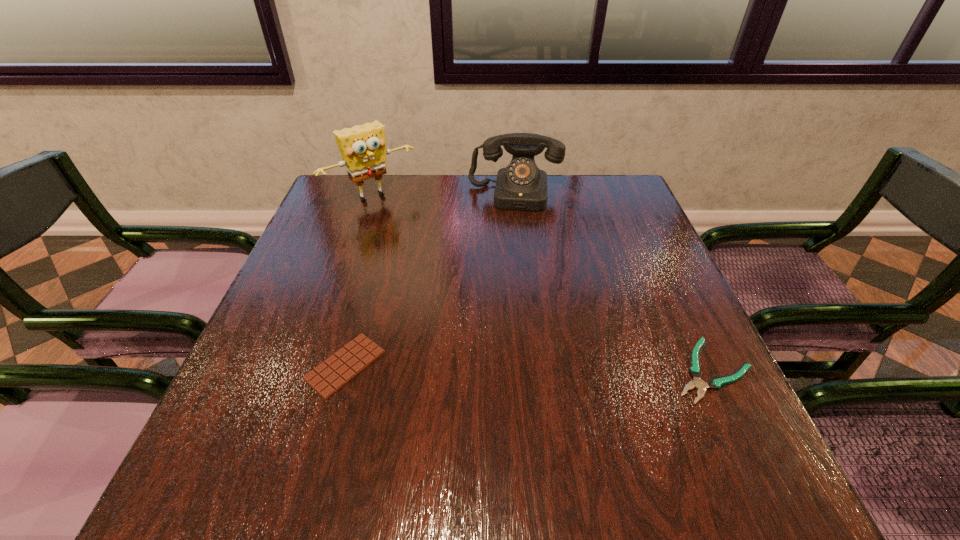
This screenshot has height=540, width=960. In order to click on candy bar in this screenshot , I will do `click(334, 373)`.

What are the coordinates of `the rightmost object` in the screenshot? It's located at (695, 371).

At what (x,y) coordinates should I click in order to perform the action: click on the second tallest object. Please return your answer as a coordinate pair (x, y). Looking at the image, I should click on (521, 185).

The width and height of the screenshot is (960, 540). Identify the location of telephone. (521, 185).

This screenshot has height=540, width=960. What are the coordinates of `sponge` in the screenshot? It's located at (362, 147).

Locate an element on the screen. free space located on the right of the candy bar is located at coordinates (565, 366).

The height and width of the screenshot is (540, 960). What are the coordinates of `vacant area located on the back of the pliers` in the screenshot? It's located at (647, 237).

Identify the location of free space located 0.070m on the dial of the second object from right to left. Image resolution: width=960 pixels, height=540 pixels. (511, 226).

Image resolution: width=960 pixels, height=540 pixels. I want to click on free region located on the dial of the second object from right to left, so click(x=508, y=259).

The width and height of the screenshot is (960, 540). I want to click on free space located 0.320m on the dial of the second object from right to left, so click(505, 289).